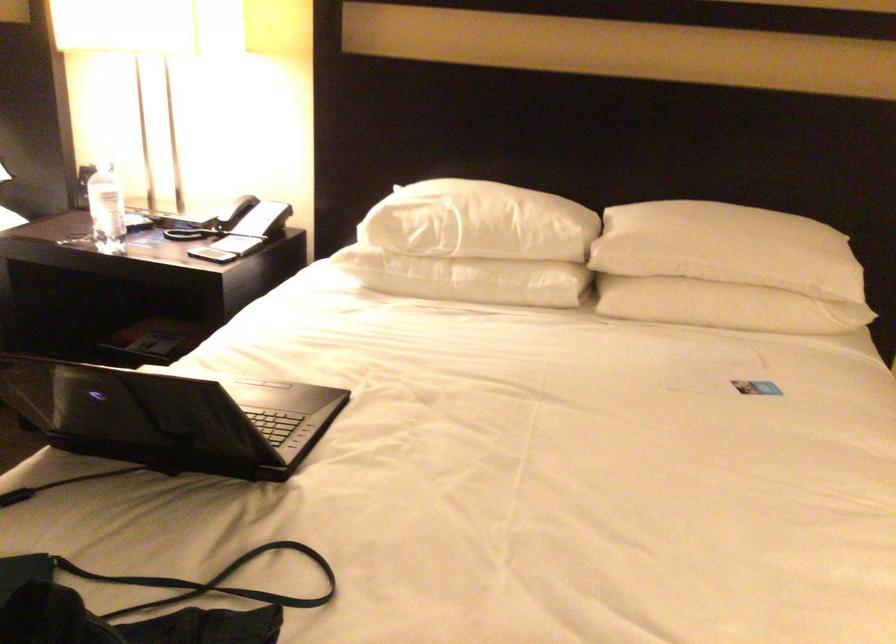
Image resolution: width=896 pixels, height=644 pixels. What do you see at coordinates (104, 160) in the screenshot? I see `the bottle cap` at bounding box center [104, 160].